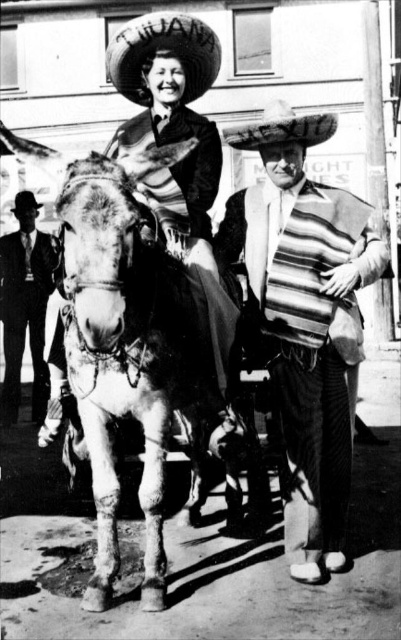
In the vintage photograph, there are two points marked at coordinates point (119,72) and point (30,196). From the perspective of someone looking at the image, which point is closer to the front of the scene?

Point (119,72) is closer to the front of the scene because it is in front of point (30,196) according to the spatial description provided.

You are a tailor observing a vintage photograph. You notice two items of clothing in the image. The first is a smooth black suit at left, and the second is a black felt cowboy hat at upper left. Which item of clothing is larger in size?

The smooth black suit at left is bigger than the black felt cowboy hat at upper left.